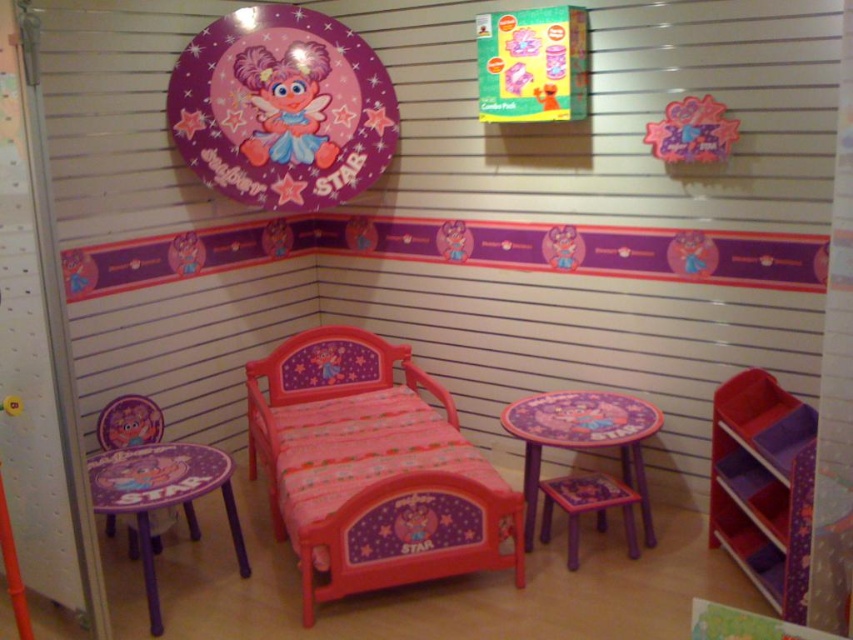
You are standing in the childrens bedroom and need to find the matte plastic plate at upper center. According to the scene description, where should you look to find it?

The matte plastic plate at upper center is located at point (282,108) in the scene.

You are a parent trying to decide if your child can safely climb onto the matte plastic bed at center from the purple plastic table at center. Considering their height, would this be possible?

The matte plastic bed at center is much taller than the purple plastic table at center, so it might be difficult for the child to safely climb onto the bed from the table without assistance.

You are a child trying to find your plate in the room. You see the matte plastic bed at center and the matte plastic plate at upper center. Which object is located to the left of the other?

The matte plastic plate at upper center is located to the left of the matte plastic bed at center.